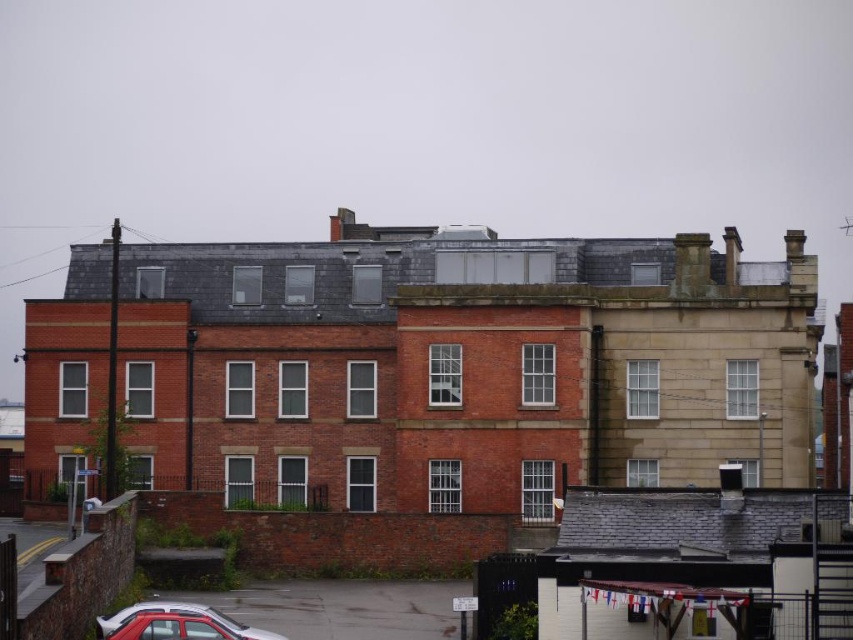
You are standing at the entrance of the building and want to place a 10 meter long banner between the brightly colored fabric at lower right and the metallic silver car at lower left. Is there enough space to stretch the banner between them without folding it?

The distance between the brightly colored fabric at lower right and the metallic silver car at lower left is 12.46 meters, which is longer than the 10 meter banner. Therefore, there is enough space to stretch the banner between them without folding it.

You are standing in front of the building and notice the brightly colored fabric at lower right and the metallic silver car at lower left. Which object is positioned closer to the right side of the building?

The brightly colored fabric at lower right is positioned to the right of the metallic silver car at lower left, so it is closer to the right side of the building.

You are standing in front of the building and notice a point marked at coordinates (659, 595). Based on the scene description, what object or feature is located at that point?

The point at coordinates (659, 595) marks the location of the brightly colored fabric at lower right.